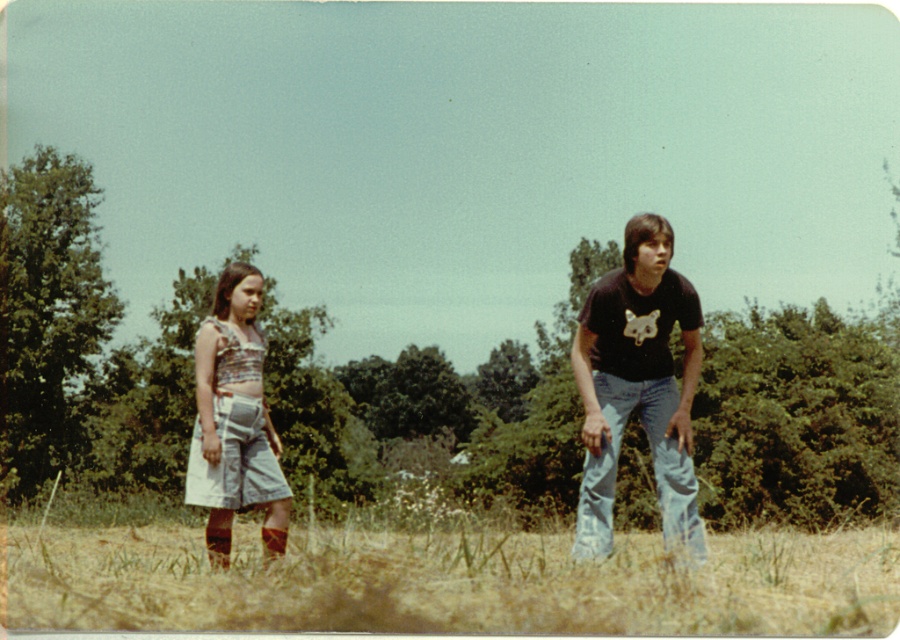
Question: Which object appears farthest from the camera in this image?

Choices:
 (A) denim shorts at left
 (B) black cotton shirt at right

Answer: (A)

Question: Is grassy field at lower center positioned behind black cotton shirt at right?

Choices:
 (A) no
 (B) yes

Answer: (A)

Question: Does black cotton shirt at right appear on the left side of denim shorts at left?

Choices:
 (A) no
 (B) yes

Answer: (A)

Question: Among these points, which one is nearest to the camera?

Choices:
 (A) (138, 577)
 (B) (248, 502)
 (C) (605, 376)

Answer: (A)

Question: Is grassy field at lower center wider than black cotton shirt at right?

Choices:
 (A) yes
 (B) no

Answer: (A)

Question: Which point is closer to the camera?

Choices:
 (A) 689,540
 (B) 550,621
 (C) 240,502

Answer: (B)